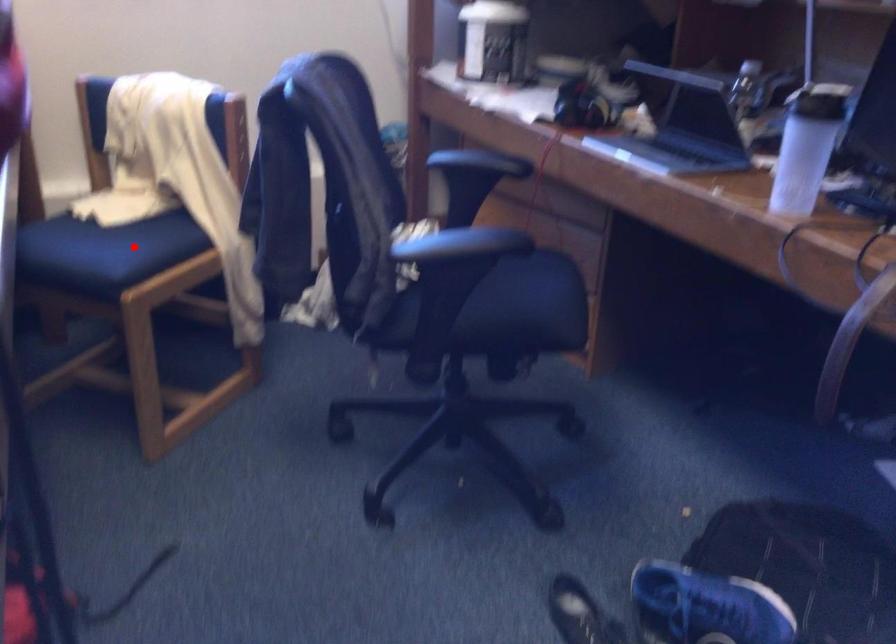
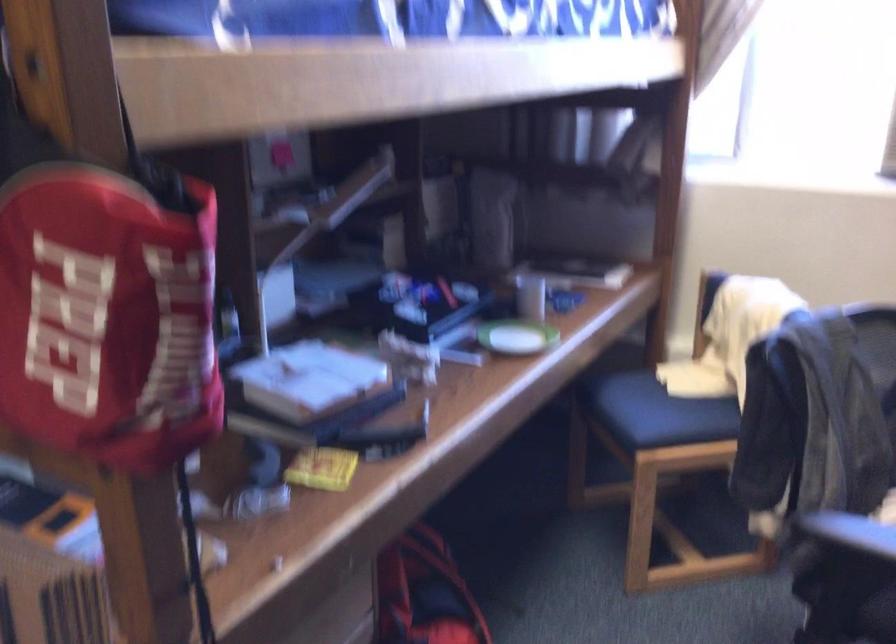
In the second image, find the point that corresponds to the highlighted location in the first image.

(668, 415)